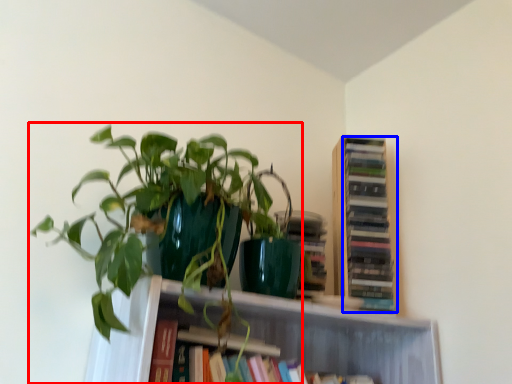
Question: Among these objects, which one is farthest to the camera, houseplant (highlighted by a red box) or book (highlighted by a blue box)?

Choices:
 (A) houseplant
 (B) book

Answer: (B)